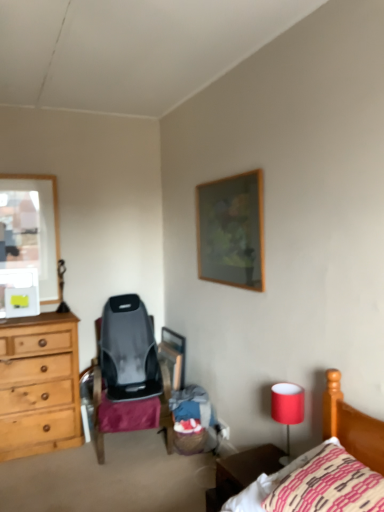
Identify the location of wooden picture frame at upper center. The image size is (384, 512). (231, 231).

You are a GUI agent. You are given a task and a screenshot of the screen. Output one action in this format:
    pyautogui.click(x=<x>, y=<y>)
    Task: Click on the red fabric lampshade at lower right
    This screenshot has height=512, width=384.
    Given the screenshot: What is the action you would take?
    287,410

At what (x,y) coordinates should I click in order to perform the action: click on knitted cotton pillow at lower right. Please return your answer as a coordinate pair (x, y). Looking at the image, I should click on [x=329, y=485].

Describe the element at coordinates (241, 473) in the screenshot. I see `brown wooden nightstand at lower right` at that location.

Locate an element on the screen. This screenshot has width=384, height=512. wooden picture frame at upper center is located at coordinates (231, 231).

Between red fabric lampshade at lower right and knitted cotton pillow at lower right, which one has larger size?

With larger size is knitted cotton pillow at lower right.

Could you tell me if red fabric lampshade at lower right is facing knitted cotton pillow at lower right?

No, red fabric lampshade at lower right is not oriented towards knitted cotton pillow at lower right.

From a real-world perspective, who is located lower, red fabric lampshade at lower right or knitted cotton pillow at lower right?

red fabric lampshade at lower right is physically lower.

Considering the relative sizes of red fabric lampshade at lower right and knitted cotton pillow at lower right in the image provided, is red fabric lampshade at lower right thinner than knitted cotton pillow at lower right?

Correct, the width of red fabric lampshade at lower right is less than that of knitted cotton pillow at lower right.

Is wooden picture frame at upper center to the left of red fabric lampshade at lower right from the viewer's perspective?

Yes.

Image resolution: width=384 pixels, height=512 pixels. In order to click on table lamp directly beneath the wooden picture frame at upper center (from a real-world perspective) in this screenshot , I will do `click(287, 410)`.

From a real-world perspective, does wooden picture frame at upper center stand above red fabric lampshade at lower right?

Yes, from a real-world perspective, wooden picture frame at upper center is over red fabric lampshade at lower right

Is wooden picture frame at upper center inside or outside of red fabric lampshade at lower right?

The correct answer is: outside.

Does knitted cotton pillow at lower right have a greater width compared to red fabric lampshade at lower right?

Yes, knitted cotton pillow at lower right is wider than red fabric lampshade at lower right.

Considering the relative sizes of knitted cotton pillow at lower right and red fabric lampshade at lower right in the image provided, is knitted cotton pillow at lower right taller than red fabric lampshade at lower right?

No.

Could you tell me if knitted cotton pillow at lower right is facing red fabric lampshade at lower right?

No, knitted cotton pillow at lower right is not turned towards red fabric lampshade at lower right.

Which is behind, knitted cotton pillow at lower right or red fabric lampshade at lower right?

red fabric lampshade at lower right is more distant.

Is wooden picture frame at upper center positioned in front of knitted cotton pillow at lower right?

No, wooden picture frame at upper center is further to the viewer.

Is wooden picture frame at upper center facing towards knitted cotton pillow at lower right?

No.

Who is bigger, wooden picture frame at upper center or knitted cotton pillow at lower right?

knitted cotton pillow at lower right.

In terms of height, does wooden picture frame at upper center look taller or shorter compared to knitted cotton pillow at lower right?

In the image, wooden picture frame at upper center appears to be taller than knitted cotton pillow at lower right.

Could you tell me if brown wooden nightstand at lower right is turned towards knitted cotton pillow at lower right?

No, brown wooden nightstand at lower right does not turn towards knitted cotton pillow at lower right.

From a real-world perspective, between brown wooden nightstand at lower right and knitted cotton pillow at lower right, who is vertically lower?

brown wooden nightstand at lower right is physically lower.

What's the angular difference between brown wooden nightstand at lower right and knitted cotton pillow at lower right's facing directions?

brown wooden nightstand at lower right and knitted cotton pillow at lower right are facing 6.61 degrees away from each other.

Does brown wooden nightstand at lower right have a lesser height compared to knitted cotton pillow at lower right?

Yes.

Based on the photo, measure the distance between brown wooden nightstand at lower right and red fabric lampshade at lower right.

9.97 inches.

What's the angular difference between brown wooden nightstand at lower right and red fabric lampshade at lower right's facing directions?

There is a 0.000135-degree angle between the facing directions of brown wooden nightstand at lower right and red fabric lampshade at lower right.

Based on the photo, who is smaller, brown wooden nightstand at lower right or red fabric lampshade at lower right?

red fabric lampshade at lower right.

Is brown wooden nightstand at lower right situated inside red fabric lampshade at lower right or outside?

The correct answer is: outside.

From the image's perspective, is knitted cotton pillow at lower right located above brown wooden nightstand at lower right?

Indeed, from the image's perspective, knitted cotton pillow at lower right is shown above brown wooden nightstand at lower right.

Is brown wooden nightstand at lower right located within knitted cotton pillow at lower right?

Definitely not — brown wooden nightstand at lower right is not inside knitted cotton pillow at lower right.

Are knitted cotton pillow at lower right and brown wooden nightstand at lower right far apart?

No.

Which point is more distant from viewer, (x=285, y=487) or (x=241, y=461)?

The point (x=241, y=461) is behind.

Identify the location of pillow above the red fabric lampshade at lower right (from a real-world perspective). This screenshot has width=384, height=512. (329, 485).

Where is `table lamp that appears on the right of wooden picture frame at upper center`? The image size is (384, 512). table lamp that appears on the right of wooden picture frame at upper center is located at coordinates (287, 410).

From the image, which object appears to be nearer to brown wooden nightstand at lower right, wooden picture frame at upper center or red fabric lampshade at lower right?

The object closer to brown wooden nightstand at lower right is red fabric lampshade at lower right.

Estimate the real-world distances between objects in this image. Which object is closer to knitted cotton pillow at lower right, brown wooden nightstand at lower right or wooden picture frame at upper center?

Among the two, brown wooden nightstand at lower right is located nearer to knitted cotton pillow at lower right.

Based on their spatial positions, is red fabric lampshade at lower right or knitted cotton pillow at lower right further from brown wooden nightstand at lower right?

knitted cotton pillow at lower right is further to brown wooden nightstand at lower right.

From the picture: Which object lies further to the anchor point wooden picture frame at upper center, brown wooden nightstand at lower right or red fabric lampshade at lower right?

brown wooden nightstand at lower right is further to wooden picture frame at upper center.

From the image, which object appears to be farther from red fabric lampshade at lower right, brown wooden nightstand at lower right or wooden picture frame at upper center?

Among the two, wooden picture frame at upper center is located further to red fabric lampshade at lower right.

Based on their spatial positions, is wooden picture frame at upper center or knitted cotton pillow at lower right closer to red fabric lampshade at lower right?

Among the two, knitted cotton pillow at lower right is located nearer to red fabric lampshade at lower right.

When comparing their distances from wooden picture frame at upper center, does knitted cotton pillow at lower right or brown wooden nightstand at lower right seem closer?

brown wooden nightstand at lower right lies closer to wooden picture frame at upper center than the other object.

Which object lies nearer to the anchor point knitted cotton pillow at lower right, red fabric lampshade at lower right or wooden picture frame at upper center?

red fabric lampshade at lower right is positioned closer to the anchor knitted cotton pillow at lower right.

Identify the location of pillow that lies between wooden picture frame at upper center and brown wooden nightstand at lower right from top to bottom. The image size is (384, 512). (329, 485).

Locate an element on the screen. Image resolution: width=384 pixels, height=512 pixels. table lamp positioned between knitted cotton pillow at lower right and wooden picture frame at upper center from near to far is located at coordinates (287, 410).

This screenshot has height=512, width=384. I want to click on table lamp between wooden picture frame at upper center and brown wooden nightstand at lower right in the up-down direction, so click(287, 410).

This screenshot has height=512, width=384. I want to click on nightstand between knitted cotton pillow at lower right and red fabric lampshade at lower right from front to back, so click(241, 473).